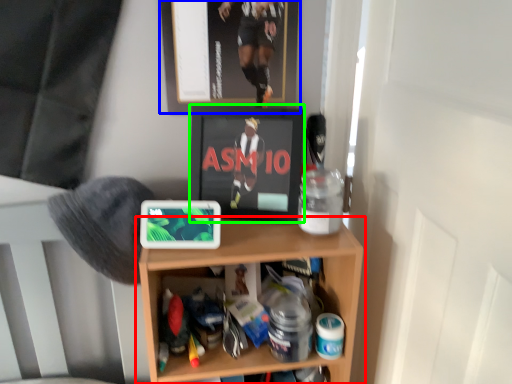
Question: Based on their relative distances, which object is nearer to shelf (highlighted by a red box)? Choose from picture frame (highlighted by a blue box) and wide (highlighted by a green box).

Choices:
 (A) picture frame
 (B) wide

Answer: (B)